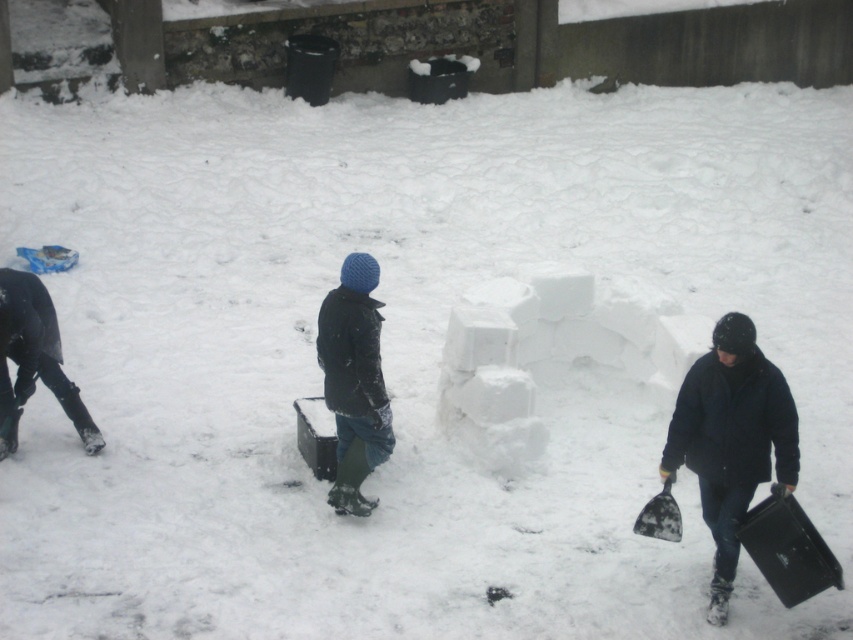
Question: Is dark blue woolen hat at center below black matte pants at lower left?

Choices:
 (A) no
 (B) yes

Answer: (B)

Question: From the image, what is the correct spatial relationship of dark blue jacket at lower right in relation to black plastic shovel at lower right?

Choices:
 (A) below
 (B) above

Answer: (B)

Question: Which point is farther to the camera?

Choices:
 (A) coord(51,376)
 (B) coord(723,512)

Answer: (A)

Question: Which point is closer to the camera taking this photo?

Choices:
 (A) (363, 412)
 (B) (33, 348)

Answer: (A)

Question: Can you confirm if dark blue woolen hat at center is positioned below black matte pants at lower left?

Choices:
 (A) yes
 (B) no

Answer: (A)

Question: Which object is the farthest from the black matte pants at lower left?

Choices:
 (A) dark blue woolen hat at center
 (B) dark blue jacket at lower right

Answer: (B)